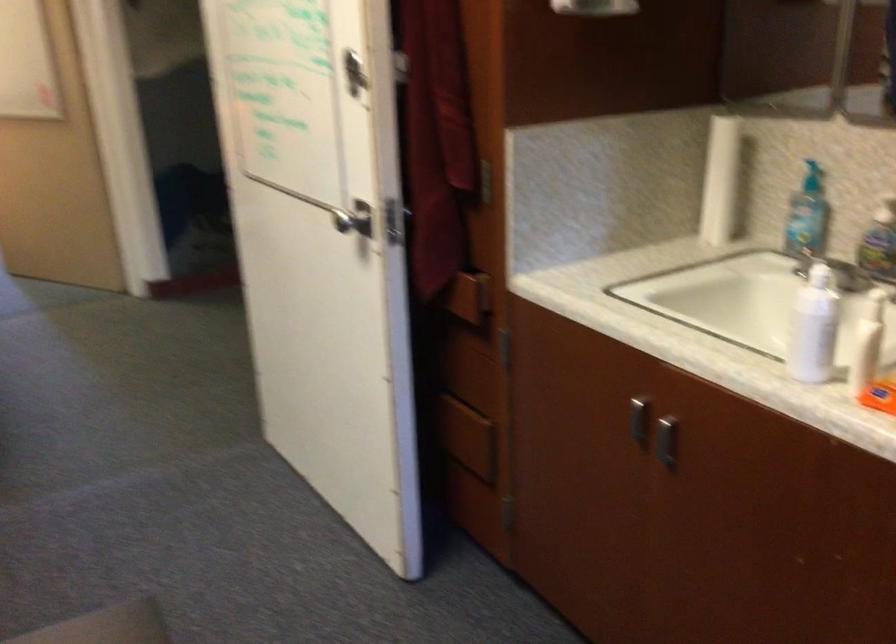
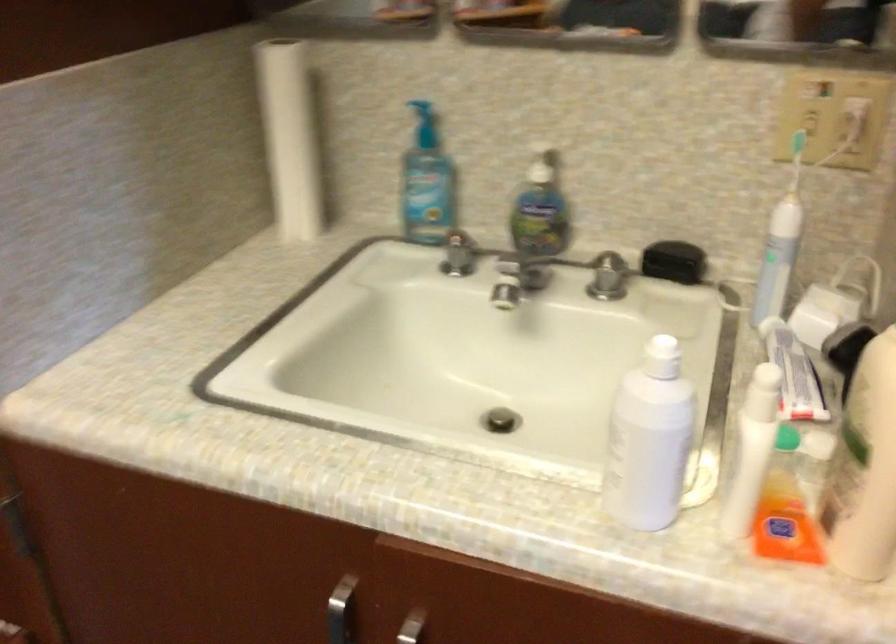
Locate, in the second image, the point that corresponds to point (639, 404) in the first image.

(340, 611)